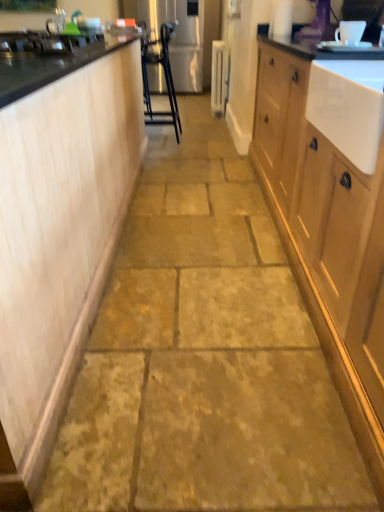
Question: Is white ceramic mug at upper center, arranged as the second appliance when viewed from the top, to the right of wooden cabinet at right, which is the first cabinetry from right to left, from the viewer's perspective?

Choices:
 (A) no
 (B) yes

Answer: (A)

Question: Is wooden cabinet at right, which is the first cabinetry from right to left, at the back of white ceramic mug at upper center, the first appliance viewed from the front?

Choices:
 (A) yes
 (B) no

Answer: (B)

Question: Is the surface of white ceramic mug at upper center, arranged as the second appliance when viewed from the top, in direct contact with wooden cabinet at right, which is the first cabinetry from right to left?

Choices:
 (A) yes
 (B) no

Answer: (B)

Question: Is white ceramic mug at upper center, placed as the 2th appliance when sorted from back to front, smaller than wooden cabinet at right, which is the first cabinetry from right to left?

Choices:
 (A) no
 (B) yes

Answer: (B)

Question: Is white ceramic mug at upper center, placed as the 2th appliance when sorted from back to front, bigger than wooden cabinet at right, which is the first cabinetry from right to left?

Choices:
 (A) no
 (B) yes

Answer: (A)

Question: Considering the positions of white painted radiator at center, arranged as the 2th appliance when viewed from the right, and metallic silver bar stool at center in the image, is white painted radiator at center, arranged as the 2th appliance when viewed from the right, taller or shorter than metallic silver bar stool at center?

Choices:
 (A) tall
 (B) short

Answer: (B)

Question: From a real-world perspective, relative to metallic silver bar stool at center, is white painted radiator at center, which appears as the 1th appliance when viewed from the top, vertically above or below?

Choices:
 (A) below
 (B) above

Answer: (A)

Question: Which is correct: white painted radiator at center, the 2th appliance positioned from the bottom, is inside metallic silver bar stool at center, or outside of it?

Choices:
 (A) inside
 (B) outside

Answer: (B)

Question: From the image's perspective, is white painted radiator at center, arranged as the 2th appliance when viewed from the right, located above or below metallic silver bar stool at center?

Choices:
 (A) above
 (B) below

Answer: (A)

Question: In the image, is light wood cabinetry at left, the first cabinetry when ordered from left to right, on the left side or the right side of white painted radiator at center, which is the first appliance from back to front?

Choices:
 (A) right
 (B) left

Answer: (B)

Question: From a real-world perspective, is light wood cabinetry at left, the 2th cabinetry when ordered from right to left, physically located above or below white painted radiator at center, which is the first appliance from back to front?

Choices:
 (A) above
 (B) below

Answer: (A)

Question: In the image, is light wood cabinetry at left, the 2th cabinetry when ordered from right to left, positioned in front of or behind white painted radiator at center, which appears as the 1th appliance when viewed from the top?

Choices:
 (A) front
 (B) behind

Answer: (A)

Question: From the image's perspective, is light wood cabinetry at left, the 2th cabinetry when ordered from right to left, positioned above or below white painted radiator at center, the 2th appliance positioned from the front?

Choices:
 (A) above
 (B) below

Answer: (B)

Question: Is silver metallic faucet at upper left in front of or behind light wood cabinetry at left, the 2th cabinetry when ordered from right to left, in the image?

Choices:
 (A) front
 (B) behind

Answer: (B)

Question: From their relative heights in the image, would you say silver metallic faucet at upper left is taller or shorter than light wood cabinetry at left, the first cabinetry when ordered from left to right?

Choices:
 (A) short
 (B) tall

Answer: (A)